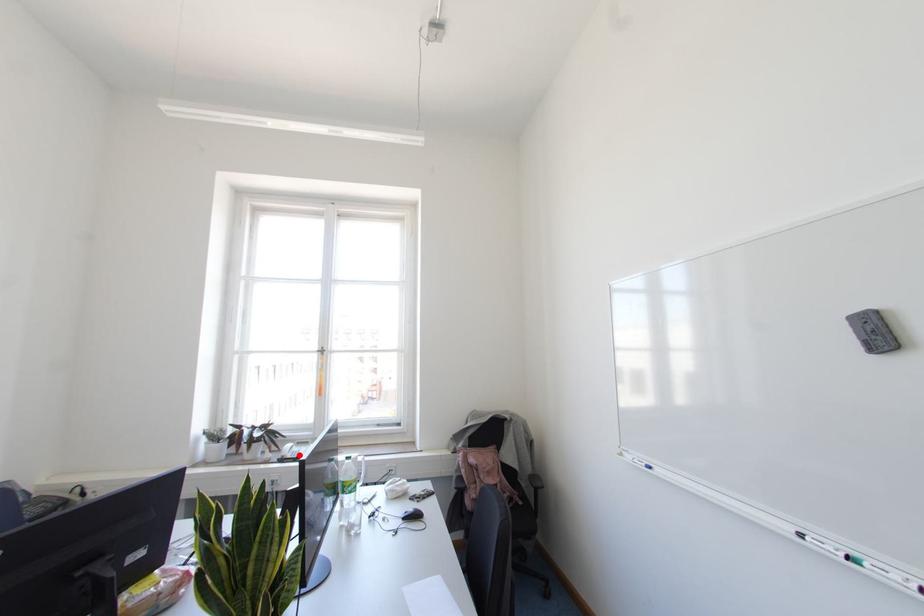
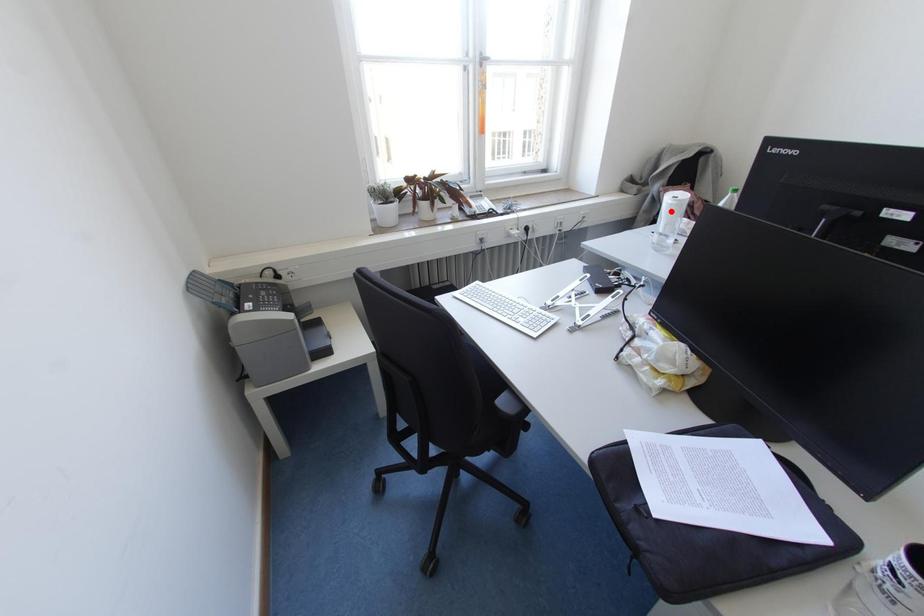
I am providing you with two images of the same scene from different viewpoints. A red point is marked on the first image and another point is marked on the second image. Are the points marked in image1 and image2 representing the same 3D position?

No